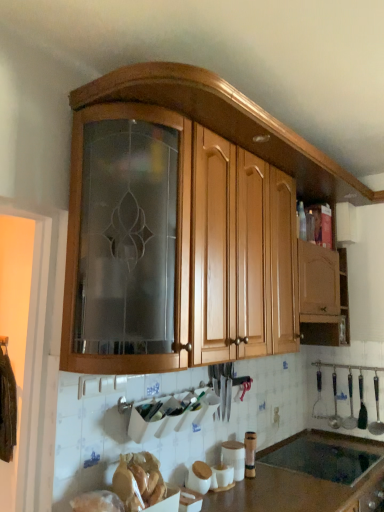
Question: Is metallic silver spoon at lower right, marked as the 1th silverware in a left-to-right arrangement, located outside white matte screen door at left?

Choices:
 (A) yes
 (B) no

Answer: (A)

Question: Can you confirm if metallic silver spoon at lower right, positioned as the second silverware in right-to-left order, is thinner than white matte screen door at left?

Choices:
 (A) no
 (B) yes

Answer: (B)

Question: Does metallic silver spoon at lower right, marked as the 1th silverware in a left-to-right arrangement, have a greater width compared to white matte screen door at left?

Choices:
 (A) no
 (B) yes

Answer: (A)

Question: Could you tell me if metallic silver spoon at lower right, marked as the 1th silverware in a left-to-right arrangement, is turned towards white matte screen door at left?

Choices:
 (A) yes
 (B) no

Answer: (B)

Question: From a real-world perspective, does metallic silver spoon at lower right, marked as the 1th silverware in a left-to-right arrangement, stand above white matte screen door at left?

Choices:
 (A) yes
 (B) no

Answer: (B)

Question: From a real-world perspective, is metallic silver spoon at lower right, positioned as the second silverware in right-to-left order, beneath white matte screen door at left?

Choices:
 (A) no
 (B) yes

Answer: (B)

Question: Considering the relative positions of black matte sink at lower center and wooden cabinet at upper center in the image provided, is black matte sink at lower center to the left of wooden cabinet at upper center from the viewer's perspective?

Choices:
 (A) yes
 (B) no

Answer: (B)

Question: Does black matte sink at lower center have a larger size compared to wooden cabinet at upper center?

Choices:
 (A) yes
 (B) no

Answer: (B)

Question: Considering the relative positions of black matte sink at lower center and wooden cabinet at upper center in the image provided, is black matte sink at lower center behind wooden cabinet at upper center?

Choices:
 (A) no
 (B) yes

Answer: (B)

Question: Does black matte sink at lower center appear on the right side of wooden cabinet at upper center?

Choices:
 (A) yes
 (B) no

Answer: (A)

Question: Could you tell me if black matte sink at lower center is turned towards wooden cabinet at upper center?

Choices:
 (A) yes
 (B) no

Answer: (B)

Question: From the image's perspective, is black matte sink at lower center beneath wooden cabinet at upper center?

Choices:
 (A) yes
 (B) no

Answer: (A)

Question: Is white matte canister at lower center, the 2th appliance from the right, outside polished metal ladle at right, positioned as the first silverware in right-to-left order?

Choices:
 (A) no
 (B) yes

Answer: (B)